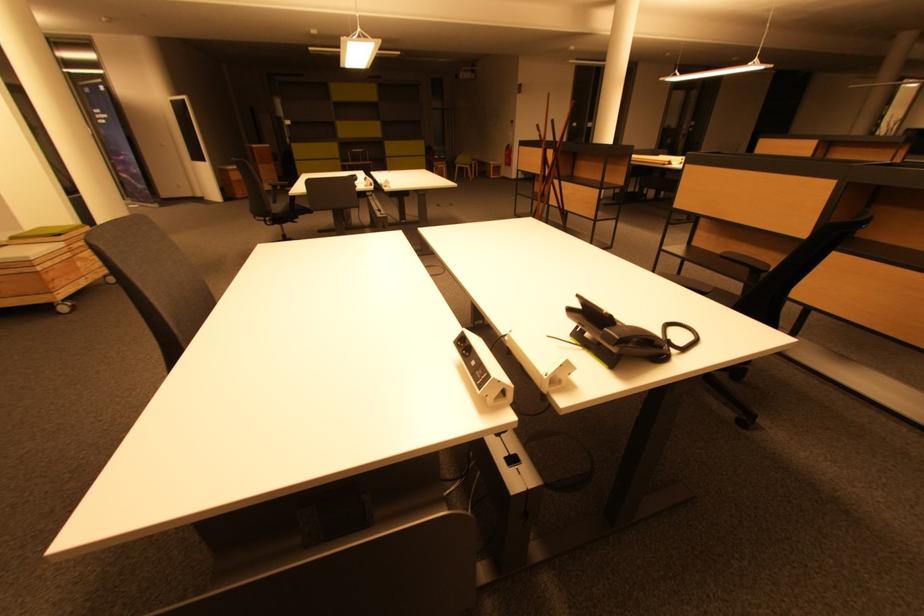
I want to click on black telephone handset, so click(x=622, y=336).